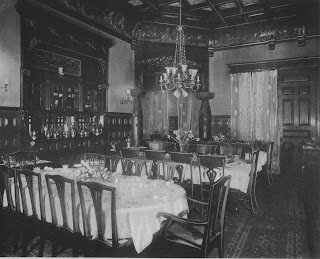
Where is `door`? The height and width of the screenshot is (259, 320). door is located at coordinates (290, 120).